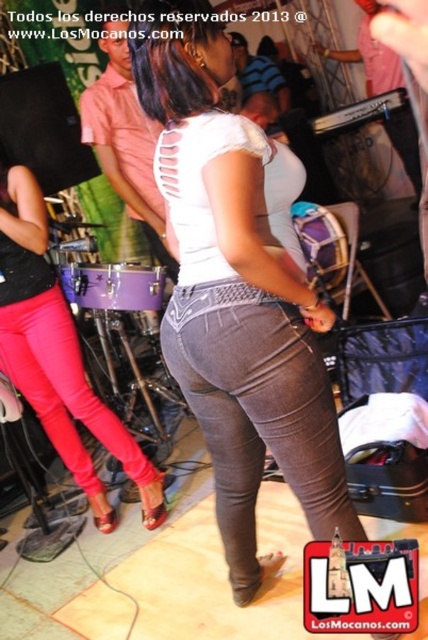
Question: Is denim jeans at center to the left of gray denim jeans at center from the viewer's perspective?

Choices:
 (A) no
 (B) yes

Answer: (B)

Question: Is gray denim jeans at center below pink matte pants at left?

Choices:
 (A) no
 (B) yes

Answer: (B)

Question: Which object appears farthest from the camera in this image?

Choices:
 (A) gray denim jeans at center
 (B) pink matte pants at left

Answer: (B)

Question: Is gray denim jeans at center below pink matte pants at left?

Choices:
 (A) no
 (B) yes

Answer: (B)

Question: Among these points, which one is farthest from the camera?

Choices:
 (A) (177, 209)
 (B) (213, 344)
 (C) (80, 454)

Answer: (C)

Question: Which of the following is the closest to the observer?

Choices:
 (A) gray denim jeans at center
 (B) pink matte pants at left

Answer: (A)